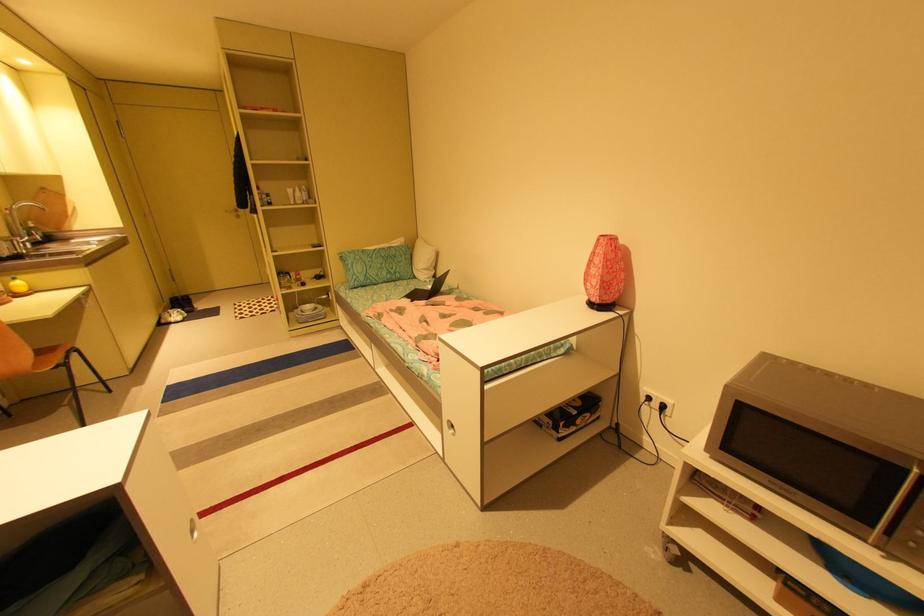
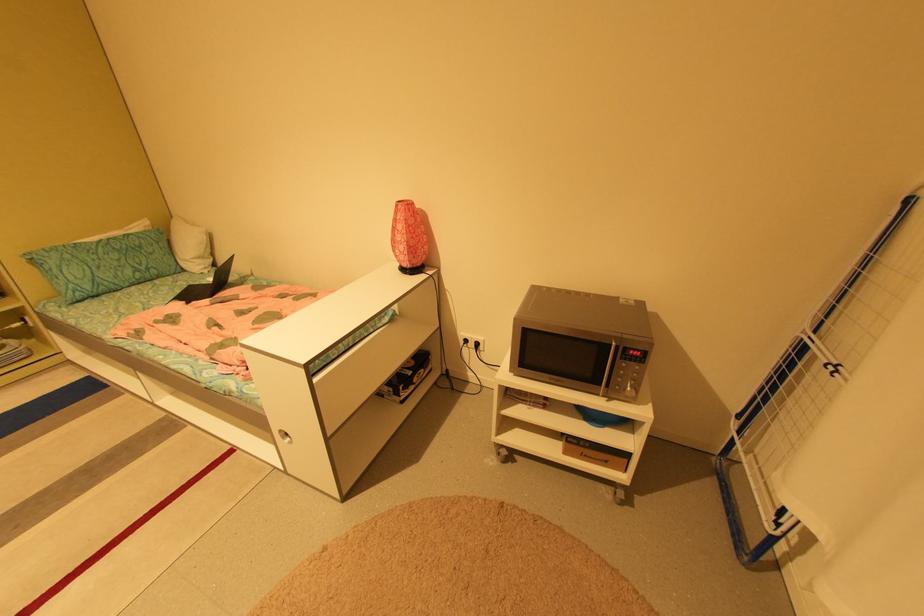
Where in the second image is the point corresponding to the point at 399,254 from the first image?

(142, 244)